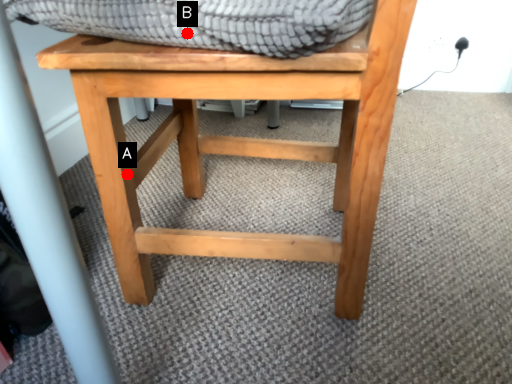
Question: Two points are circled on the image, labeled by A and B beside each circle. Which point is closer to the camera?

Choices:
 (A) A is closer
 (B) B is closer

Answer: (B)